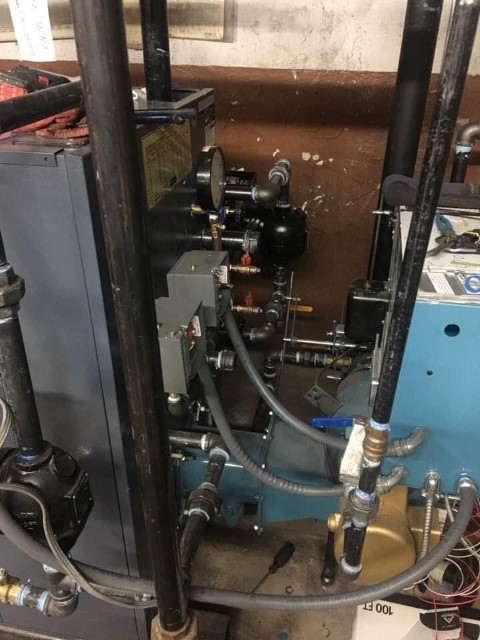
At what (x,y) coordinates should I click in order to perform the action: click on red walls. Please return your answer as a coordinate pair (x, y). Looking at the image, I should click on (271, 118).